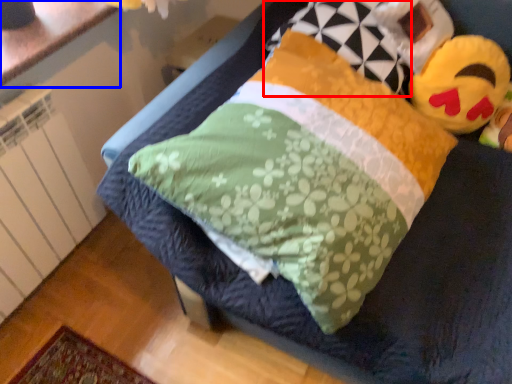
Question: Which point is closer to the camera, pillow (highlighted by a red box) or counter top (highlighted by a blue box)?

Choices:
 (A) pillow
 (B) counter top

Answer: (A)